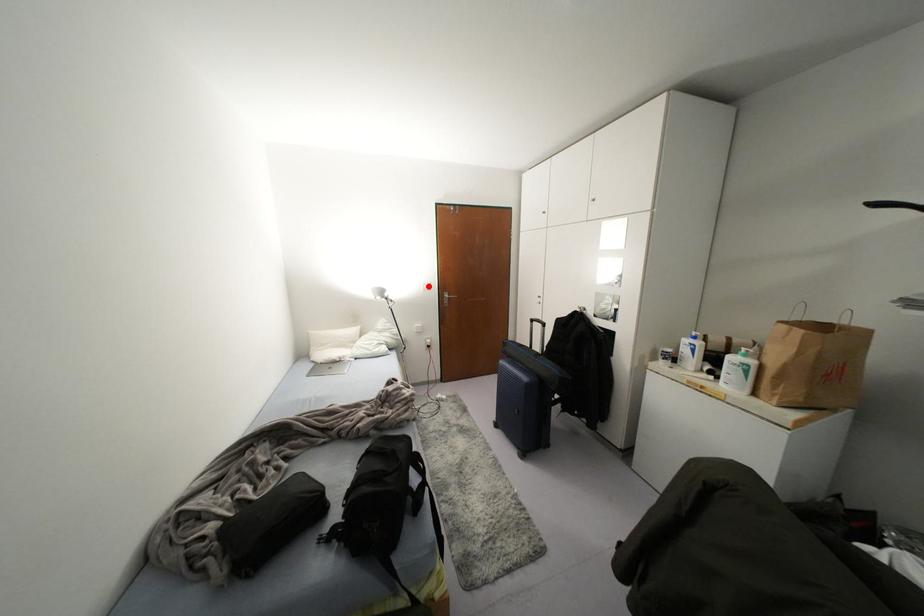
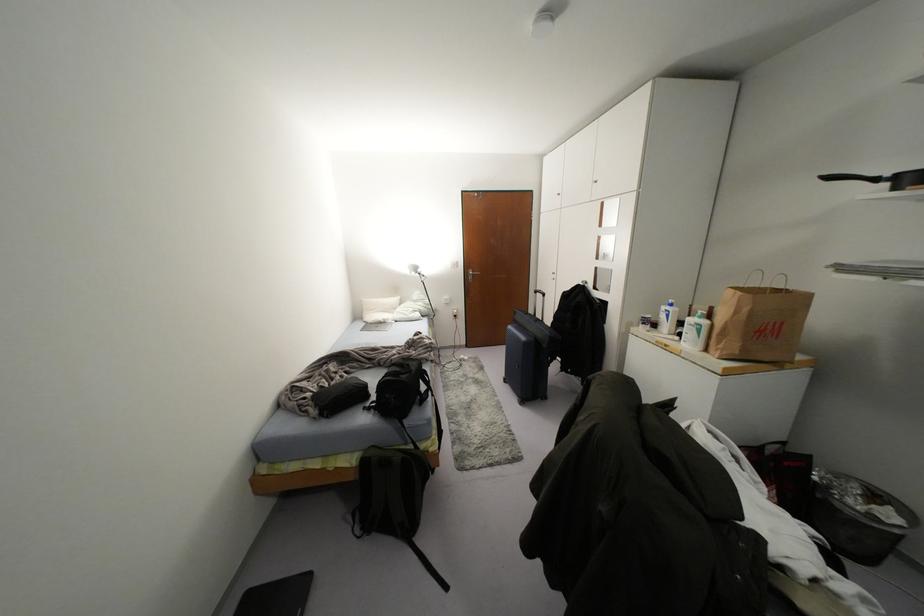
Question: I am providing you with two images of the same scene from different viewpoints. A red point is marked on the first image. At the location where the point appears in image 1, is it still visible in image 2?

Choices:
 (A) Yes
 (B) No

Answer: (A)